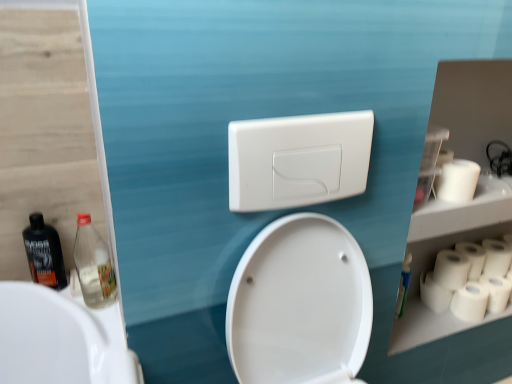
Question: Is white matte toilet paper at right, the second toilet paper when ordered from bottom to top, to the right of white plastic switch at upper center from the viewer's perspective?

Choices:
 (A) yes
 (B) no

Answer: (A)

Question: Is white matte toilet paper at right, the 5th toilet paper when ordered from top to bottom, closer to camera compared to white plastic switch at upper center?

Choices:
 (A) yes
 (B) no

Answer: (B)

Question: Are white matte toilet paper at right, the second toilet paper when ordered from bottom to top, and white plastic switch at upper center making contact?

Choices:
 (A) yes
 (B) no

Answer: (B)

Question: Is white matte toilet paper at right, the 5th toilet paper when ordered from top to bottom, shorter than white plastic switch at upper center?

Choices:
 (A) yes
 (B) no

Answer: (A)

Question: From a real-world perspective, is white matte toilet paper at right, the second toilet paper when ordered from bottom to top, under white plastic switch at upper center?

Choices:
 (A) yes
 (B) no

Answer: (A)

Question: Which is correct: matte black bottle at left, arranged as the second bottle when viewed from the right, is inside clear plastic bottle at left, which is the first bottle in right-to-left order, or outside of it?

Choices:
 (A) inside
 (B) outside

Answer: (B)

Question: Considering their positions, is matte black bottle at left, which is counted as the first bottle, starting from the left, located in front of or behind clear plastic bottle at left, placed as the 2th bottle when sorted from left to right?

Choices:
 (A) front
 (B) behind

Answer: (B)

Question: Considering the positions of point (39, 254) and point (99, 259), is point (39, 254) closer or farther from the camera than point (99, 259)?

Choices:
 (A) farther
 (B) closer

Answer: (B)

Question: In terms of size, does matte black bottle at left, which is counted as the first bottle, starting from the left, appear bigger or smaller than clear plastic bottle at left, which is the first bottle in right-to-left order?

Choices:
 (A) small
 (B) big

Answer: (A)

Question: From the image's perspective, is white matte toilet paper at right, which ranks as the 2th toilet paper in top-to-bottom order, above or below clear plastic bottle at left, which is the first bottle in right-to-left order?

Choices:
 (A) above
 (B) below

Answer: (B)

Question: From a real-world perspective, is white matte toilet paper at right, the fifth toilet paper when ordered from bottom to top, positioned above or below clear plastic bottle at left, placed as the 2th bottle when sorted from left to right?

Choices:
 (A) above
 (B) below

Answer: (B)

Question: Would you say white matte toilet paper at right, which ranks as the 2th toilet paper in top-to-bottom order, is inside or outside clear plastic bottle at left, placed as the 2th bottle when sorted from left to right?

Choices:
 (A) inside
 (B) outside

Answer: (B)

Question: Is point pyautogui.click(x=492, y=243) closer or farther from the camera than point pyautogui.click(x=84, y=221)?

Choices:
 (A) closer
 (B) farther

Answer: (B)

Question: From a real-world perspective, is white matte toilet paper at right, which is the first toilet paper in top-to-bottom order, physically located above or below white matte toilet paper at right, arranged as the sixth toilet paper when viewed from the top?

Choices:
 (A) above
 (B) below

Answer: (A)

Question: Looking at the image, does white matte toilet paper at right, which is the first toilet paper in top-to-bottom order, seem bigger or smaller compared to white matte toilet paper at right, arranged as the sixth toilet paper when viewed from the top?

Choices:
 (A) big
 (B) small

Answer: (A)